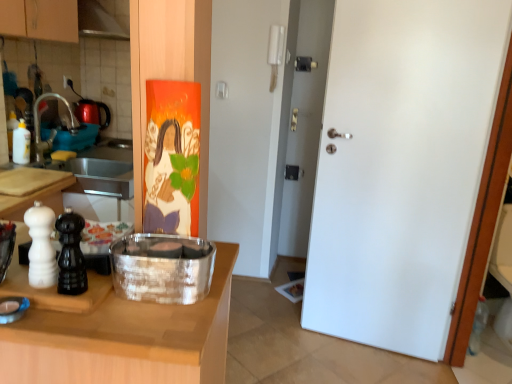
Describe the element at coordinates (36, 197) in the screenshot. I see `wooden cutting board at left, marked as the 1th countertop in a top-to-bottom arrangement` at that location.

Measure the distance between wooden cutting board at left, marked as the 1th countertop in a top-to-bottom arrangement, and camera.

The depth of wooden cutting board at left, marked as the 1th countertop in a top-to-bottom arrangement, is 1.28 meters.

Describe the element at coordinates (162, 268) in the screenshot. This screenshot has height=384, width=512. I see `silver metallic container at center` at that location.

What is the approximate width of wooden cutting board at left, which appears as the 2th countertop when viewed from the top?

wooden cutting board at left, which appears as the 2th countertop when viewed from the top, is 3.74 feet wide.

At what (x,y) coordinates should I click in order to perform the action: click on wooden cutting board at left, marked as the second countertop in a bottom-to-top arrangement. Please return your answer as a coordinate pair (x, y). Looking at the image, I should click on (36, 197).

Is silver metallic container at center next to brushed metal faucet at left?

No, silver metallic container at center is not touching brushed metal faucet at left.

Is the position of silver metallic container at center more distant than that of brushed metal faucet at left?

No, the depth of silver metallic container at center is less than that of brushed metal faucet at left.

Considering the relative positions of silver metallic container at center and brushed metal faucet at left in the image provided, is silver metallic container at center to the left or to the right of brushed metal faucet at left?

silver metallic container at center is to the right of brushed metal faucet at left.

How far apart are silver metallic container at center and brushed metal faucet at left?

They are 4.20 feet apart.

I want to click on bottle behind the wooden cutting board at left, marked as the 1th countertop in a top-to-bottom arrangement, so pyautogui.click(x=21, y=144).

Is wooden cutting board at left, marked as the second countertop in a bottom-to-top arrangement, wider or thinner than white glossy bottle at left?

wooden cutting board at left, marked as the second countertop in a bottom-to-top arrangement, is wider than white glossy bottle at left.

What's the angular difference between wooden cutting board at left, marked as the second countertop in a bottom-to-top arrangement, and white glossy bottle at left's facing directions?

The angular difference between wooden cutting board at left, marked as the second countertop in a bottom-to-top arrangement, and white glossy bottle at left is 3.82 degrees.

Could you tell me if wooden cutting board at left, marked as the 1th countertop in a top-to-bottom arrangement, is facing white glossy bottle at left?

No, wooden cutting board at left, marked as the 1th countertop in a top-to-bottom arrangement, does not turn towards white glossy bottle at left.

Which is nearer, [37,105] or [7,200]?

Positioned in front is point [7,200].

From the image's perspective, relative to wooden cutting board at left, marked as the second countertop in a bottom-to-top arrangement, is brushed metal faucet at left above or below?

brushed metal faucet at left is above wooden cutting board at left, marked as the second countertop in a bottom-to-top arrangement.

Can we say brushed metal faucet at left lies outside wooden cutting board at left, marked as the 1th countertop in a top-to-bottom arrangement?

Indeed, brushed metal faucet at left is completely outside wooden cutting board at left, marked as the 1th countertop in a top-to-bottom arrangement.

Can you tell me how much white glossy bottle at left and wooden cutting board at left, marked as the 1th countertop in a top-to-bottom arrangement, differ in facing direction?

white glossy bottle at left and wooden cutting board at left, marked as the 1th countertop in a top-to-bottom arrangement, are facing 3.82 degrees away from each other.

Between white glossy bottle at left and wooden cutting board at left, marked as the second countertop in a bottom-to-top arrangement, which one appears on the right side from the viewer's perspective?

Positioned to the right is wooden cutting board at left, marked as the second countertop in a bottom-to-top arrangement.

Is white glossy bottle at left beside wooden cutting board at left, marked as the 1th countertop in a top-to-bottom arrangement?

There is a gap between white glossy bottle at left and wooden cutting board at left, marked as the 1th countertop in a top-to-bottom arrangement.

Considering the points (16, 132) and (15, 169), which point is in front, point (16, 132) or point (15, 169)?

The point (15, 169) is in front.

Is point (15, 133) positioned in front of point (36, 144)?

Yes, it is.

Which object is more forward, white glossy bottle at left or brushed metal faucet at left?

white glossy bottle at left is more forward.

Considering the relative sizes of white glossy bottle at left and brushed metal faucet at left in the image provided, is white glossy bottle at left bigger than brushed metal faucet at left?

No.

Can you confirm if white glossy bottle at left is shorter than brushed metal faucet at left?

Yes, white glossy bottle at left is shorter than brushed metal faucet at left.

Which countertop is the 1st one when counting from the left side of the silver metallic container at center? Please provide its 2D coordinates.

[(125, 339)]

Is silver metallic container at center positioned beyond the bounds of wooden cutting board at left, marked as the 1th countertop in a bottom-to-top arrangement?

Yes.

Considering the sizes of silver metallic container at center and wooden cutting board at left, which appears as the 2th countertop when viewed from the top, in the image, is silver metallic container at center wider or thinner than wooden cutting board at left, which appears as the 2th countertop when viewed from the top,?

silver metallic container at center is thinner than wooden cutting board at left, which appears as the 2th countertop when viewed from the top.

Measure the distance between silver metallic container at center and wooden cutting board at left, which appears as the 2th countertop when viewed from the top.

The distance of silver metallic container at center from wooden cutting board at left, which appears as the 2th countertop when viewed from the top, is 3.77 inches.

Where is `kitchen appliance below the white glossy bottle at left (from the image's perspective)`? kitchen appliance below the white glossy bottle at left (from the image's perspective) is located at coordinates (162, 268).

Considering the points (178, 301) and (22, 122), which point is in front, point (178, 301) or point (22, 122)?

The point (178, 301) is more forward.

The image size is (512, 384). I want to click on kitchen appliance below the brushed metal faucet at left (from a real-world perspective), so click(162, 268).

This screenshot has height=384, width=512. In order to click on the 1st countertop below the white glossy bottle at left (from the image's perspective) in this screenshot , I will do `click(36, 197)`.

Considering their positions, is silver metallic container at center positioned closer to wooden cutting board at left, marked as the 1th countertop in a top-to-bottom arrangement, than white glossy bottle at left?

white glossy bottle at left is positioned closer to the anchor wooden cutting board at left, marked as the 1th countertop in a top-to-bottom arrangement.

From the image, which object appears to be farther from silver metallic container at center, white glossy bottle at left or wooden cutting board at left, marked as the second countertop in a bottom-to-top arrangement?

white glossy bottle at left is positioned further to the anchor silver metallic container at center.

When comparing their distances from silver metallic container at center, does brushed metal faucet at left or wooden cutting board at left, marked as the 1th countertop in a bottom-to-top arrangement, seem further?

brushed metal faucet at left is positioned further to the anchor silver metallic container at center.

Looking at the image, which one is located further to wooden cutting board at left, marked as the 1th countertop in a top-to-bottom arrangement, white glossy bottle at left or brushed metal faucet at left?

brushed metal faucet at left lies further to wooden cutting board at left, marked as the 1th countertop in a top-to-bottom arrangement, than the other object.

Which object lies nearer to the anchor point wooden cutting board at left, marked as the second countertop in a bottom-to-top arrangement, white glossy bottle at left or wooden cutting board at left, marked as the 1th countertop in a bottom-to-top arrangement?

Based on the image, white glossy bottle at left appears to be nearer to wooden cutting board at left, marked as the second countertop in a bottom-to-top arrangement.

Which object lies further to the anchor point brushed metal faucet at left, white glossy bottle at left or wooden cutting board at left, marked as the 1th countertop in a bottom-to-top arrangement?

The object further to brushed metal faucet at left is wooden cutting board at left, marked as the 1th countertop in a bottom-to-top arrangement.

Which object lies further to the anchor point white glossy bottle at left, wooden cutting board at left, marked as the 1th countertop in a bottom-to-top arrangement, or silver metallic container at center?

wooden cutting board at left, marked as the 1th countertop in a bottom-to-top arrangement, is further to white glossy bottle at left.

Estimate the real-world distances between objects in this image. Which object is closer to wooden cutting board at left, marked as the 1th countertop in a top-to-bottom arrangement, wooden cutting board at left, which appears as the 2th countertop when viewed from the top, or white glossy bottle at left?

The object closer to wooden cutting board at left, marked as the 1th countertop in a top-to-bottom arrangement, is white glossy bottle at left.

Where is `countertop between silver metallic container at center and white glossy bottle at left in the front-back direction`? countertop between silver metallic container at center and white glossy bottle at left in the front-back direction is located at coordinates (36, 197).

You are a GUI agent. You are given a task and a screenshot of the screen. Output one action in this format:
    pyautogui.click(x=<x>, y=<y>)
    Task: Click on the countertop located between wooden cutting board at left, which appears as the 2th countertop when viewed from the top, and brushed metal faucet at left in the depth direction
    The height and width of the screenshot is (384, 512).
    Given the screenshot: What is the action you would take?
    pyautogui.click(x=36, y=197)

Where is `bottle between silver metallic container at center and brushed metal faucet at left from front to back`? The width and height of the screenshot is (512, 384). bottle between silver metallic container at center and brushed metal faucet at left from front to back is located at coordinates (21, 144).

Locate an element on the screen. Image resolution: width=512 pixels, height=384 pixels. kitchen appliance located between wooden cutting board at left, which appears as the 2th countertop when viewed from the top, and wooden cutting board at left, marked as the 1th countertop in a top-to-bottom arrangement, in the depth direction is located at coordinates (x=162, y=268).